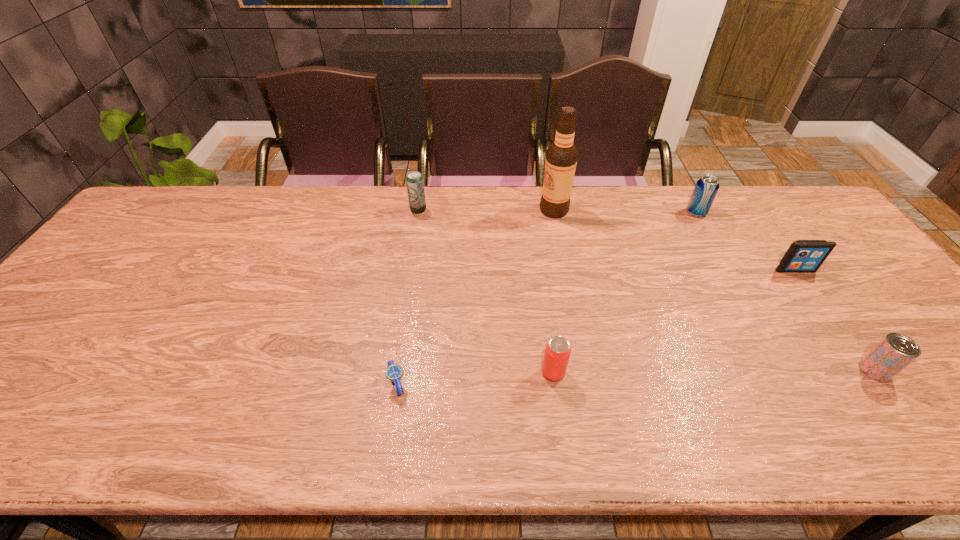
This screenshot has height=540, width=960. In the image, there is a desktop. What are the coordinates of `vacant space at the near edge` in the screenshot? It's located at (210, 439).

Where is `free location at the left edge of the desktop`? The width and height of the screenshot is (960, 540). free location at the left edge of the desktop is located at coordinates (155, 242).

This screenshot has height=540, width=960. I want to click on free space at the right edge of the desktop, so (x=842, y=238).

This screenshot has width=960, height=540. In the image, there is a desktop. Find the location of `free space at the far right corner`. free space at the far right corner is located at coordinates (780, 214).

Locate an element on the screen. free area in between the tallest object and the watch is located at coordinates (475, 297).

Locate an element on the screen. This screenshot has width=960, height=540. vacant space in between the third beer can from right to left and the second beer can from right to left is located at coordinates (625, 293).

Locate an element on the screen. Image resolution: width=960 pixels, height=540 pixels. blank region between the rightmost beer can and the watch is located at coordinates [636, 377].

This screenshot has height=540, width=960. I want to click on free spot between the fourth nearest object and the rightmost beer can, so click(x=835, y=320).

The width and height of the screenshot is (960, 540). Identify the location of free space between the alcohol and the watch. (x=475, y=297).

I want to click on free area in between the shortest object and the fifth object from left to right, so click(546, 298).